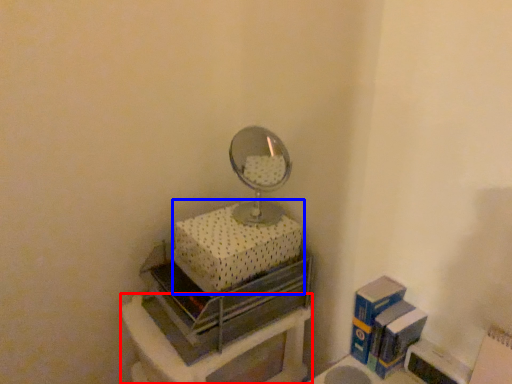
Question: Which object appears farthest to the camera in this image, furniture (highlighted by a red box) or box (highlighted by a blue box)?

Choices:
 (A) furniture
 (B) box

Answer: (B)